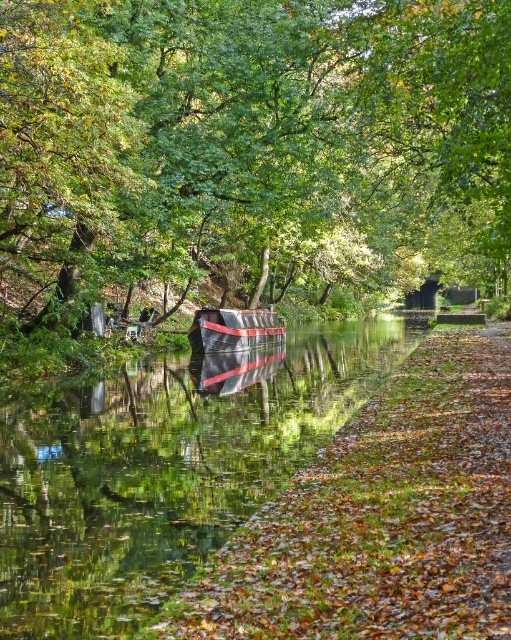
Can you confirm if green leafy tree at center is positioned below metallic silver boat at center?

No.

Where is `green leafy tree at center`? The width and height of the screenshot is (511, 640). green leafy tree at center is located at coordinates (250, 148).

Who is more distant from viewer, (389, 138) or (263, 337)?

Positioned behind is point (263, 337).

Locate an element on the screen. green leafy tree at center is located at coordinates tap(250, 148).

Is green leafy tree at center further to the viewer compared to green glossy water at center?

That is True.

Does green leafy tree at center appear over green glossy water at center?

Indeed, green leafy tree at center is positioned over green glossy water at center.

The image size is (511, 640). What are the coordinates of `green leafy tree at center` in the screenshot? It's located at (250, 148).

Which is more to the left, green glossy water at center or metallic silver boat at center?

green glossy water at center is more to the left.

Which is in front, point (153, 586) or point (240, 323)?

Point (153, 586) is more forward.

This screenshot has height=640, width=511. Find the location of `green glossy water at center`. green glossy water at center is located at coordinates (165, 468).